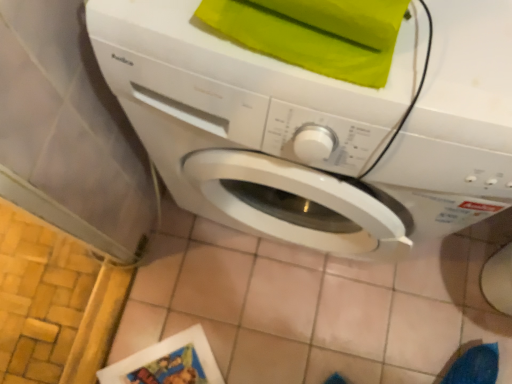
What do you see at coordinates (319, 127) in the screenshot? This screenshot has height=384, width=512. I see `white glossy washing machine at center` at bounding box center [319, 127].

The width and height of the screenshot is (512, 384). Find the location of `white glossy washing machine at center`. white glossy washing machine at center is located at coordinates [x=319, y=127].

Where is `white glossy washing machine at center`? The width and height of the screenshot is (512, 384). white glossy washing machine at center is located at coordinates (319, 127).